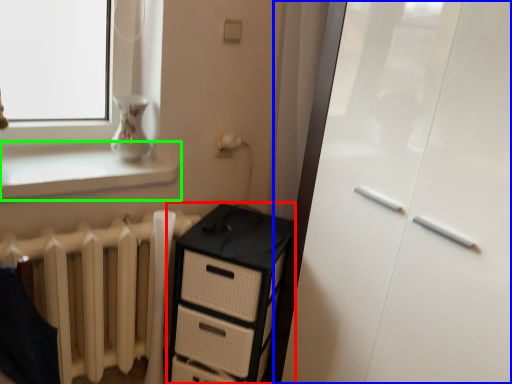
Question: Which object is positioned closest to chest of drawers (highlighted by a red box)? Select from screen door (highlighted by a blue box) and window sill (highlighted by a green box).

Choices:
 (A) screen door
 (B) window sill

Answer: (A)